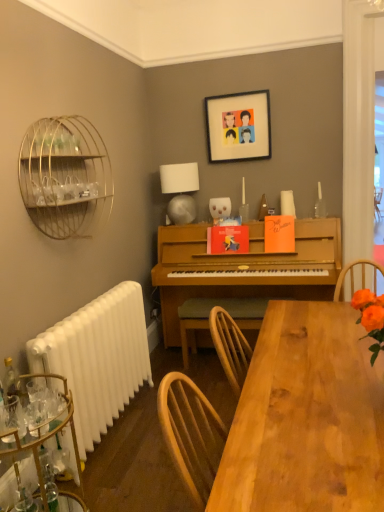
Question: Which is correct: white plastic radiator at lower left is inside wooden table at lower center, or outside of it?

Choices:
 (A) outside
 (B) inside

Answer: (A)

Question: Considering the positions of point (84, 324) and point (359, 466), is point (84, 324) closer or farther from the camera than point (359, 466)?

Choices:
 (A) closer
 (B) farther

Answer: (B)

Question: Which of these objects is positioned farthest from the white plastic radiator at lower left?

Choices:
 (A) white glossy lampshade at upper center
 (B) metallic gold bar cart at lower left
 (C) wooden table at lower center
 (D) wooden chair at center
 (E) matte plastic picture frame at upper center

Answer: (E)

Question: Estimate the real-world distances between objects in this image. Which object is farther from the white plastic radiator at lower left?

Choices:
 (A) wooden table at lower center
 (B) white glossy lampshade at upper center
 (C) metallic gold bar cart at lower left
 (D) wooden chair at center
 (E) gold wire birdcage at left

Answer: (B)